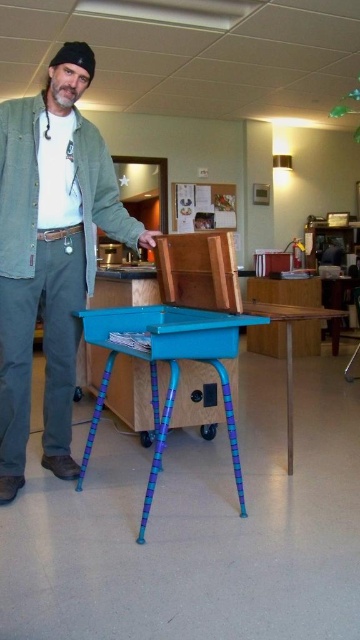
You are organizing a small event and need to arrange seating. You have a matte green jacket at center and a metallic silver folding chair at right. Which object should you move if you want the chair to be on the left side of the jacket?

You should move the metallic silver folding chair at right to the left side of the matte green jacket at center, as currently the matte green jacket at center is positioned on the left side of the metallic silver folding chair at right.